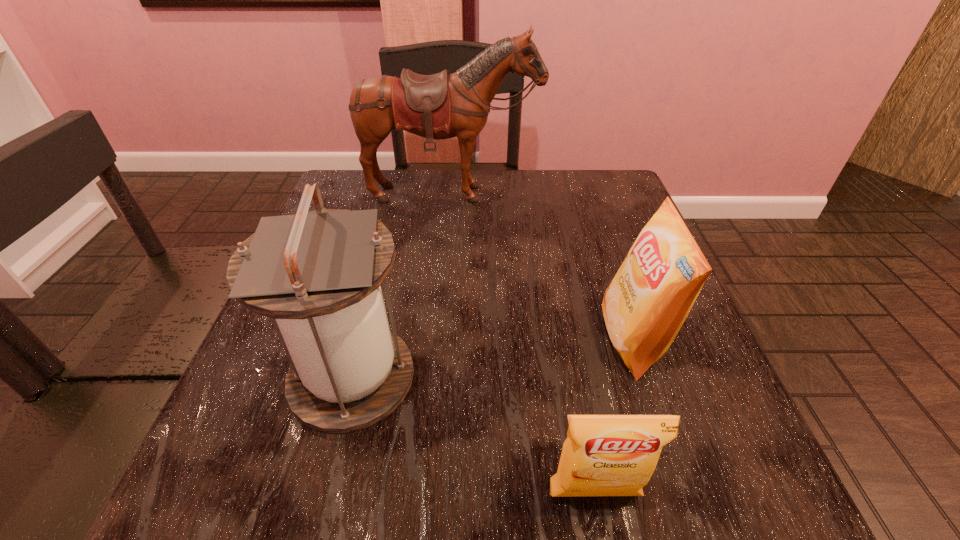
Identify the location of free space located on the front-facing side of the taller crisp (potato chip). (462, 340).

The width and height of the screenshot is (960, 540). Identify the location of vacant space located 0.220m on the front-facing side of the taller crisp (potato chip). (473, 340).

Locate an element on the screen. The image size is (960, 540). object present at the far edge is located at coordinates (440, 106).

This screenshot has height=540, width=960. I want to click on object that is positioned at the near edge, so click(604, 455).

Where is `saddle that is at the left edge`? The width and height of the screenshot is (960, 540). saddle that is at the left edge is located at coordinates (440, 106).

Image resolution: width=960 pixels, height=540 pixels. Find the location of `lantern present at the left edge`. lantern present at the left edge is located at coordinates (317, 274).

What are the coordinates of `object that is positioned at the right edge` in the screenshot? It's located at (645, 305).

The height and width of the screenshot is (540, 960). Find the location of `object present at the far left corner`. object present at the far left corner is located at coordinates (440, 106).

Image resolution: width=960 pixels, height=540 pixels. What are the coordinates of `vacant space at the far edge of the desktop` in the screenshot? It's located at (430, 195).

In the image, there is a desktop. Where is `free space at the near edge`? The image size is (960, 540). free space at the near edge is located at coordinates (507, 501).